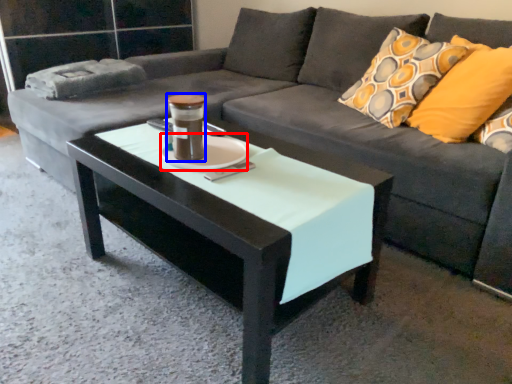
Question: Which object is further to the camera taking this photo, saucer (highlighted by a red box) or beverage (highlighted by a blue box)?

Choices:
 (A) saucer
 (B) beverage

Answer: (A)